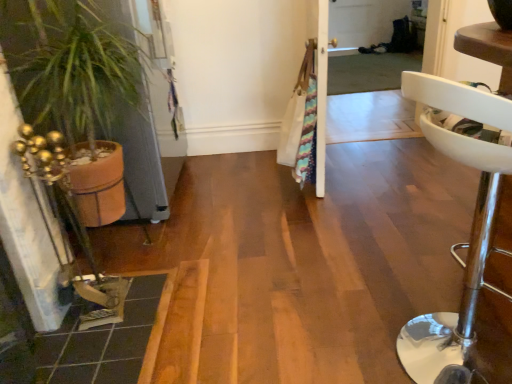
The height and width of the screenshot is (384, 512). Identify the location of vacant point to the left of white leather stool at right. (321, 332).